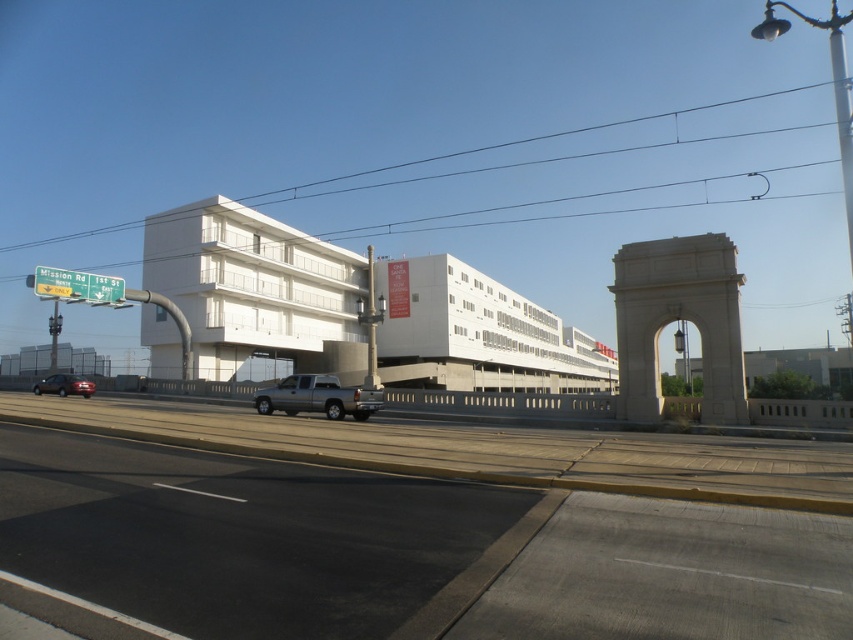
Question: Is smooth asphalt highway at center above yellow-green plastic street sign at upper left?

Choices:
 (A) yes
 (B) no

Answer: (B)

Question: Based on their relative distances, which object is nearer to the gray metallic truck at center?

Choices:
 (A) smooth asphalt highway at center
 (B) yellow-green plastic street sign at upper left

Answer: (A)

Question: Which of the following is the farthest from the observer?

Choices:
 (A) yellow-green plastic street sign at upper left
 (B) gray metallic truck at center

Answer: (A)

Question: Can you confirm if asphalt road at center is positioned above gray metallic truck at center?

Choices:
 (A) no
 (B) yes

Answer: (A)

Question: Which object is the closest to the matte black suv at lower left?

Choices:
 (A) gray metallic truck at center
 (B) asphalt road at center
 (C) yellow-green plastic street sign at upper left

Answer: (C)

Question: Does yellow-green plastic street sign at upper left appear under matte black suv at lower left?

Choices:
 (A) no
 (B) yes

Answer: (A)